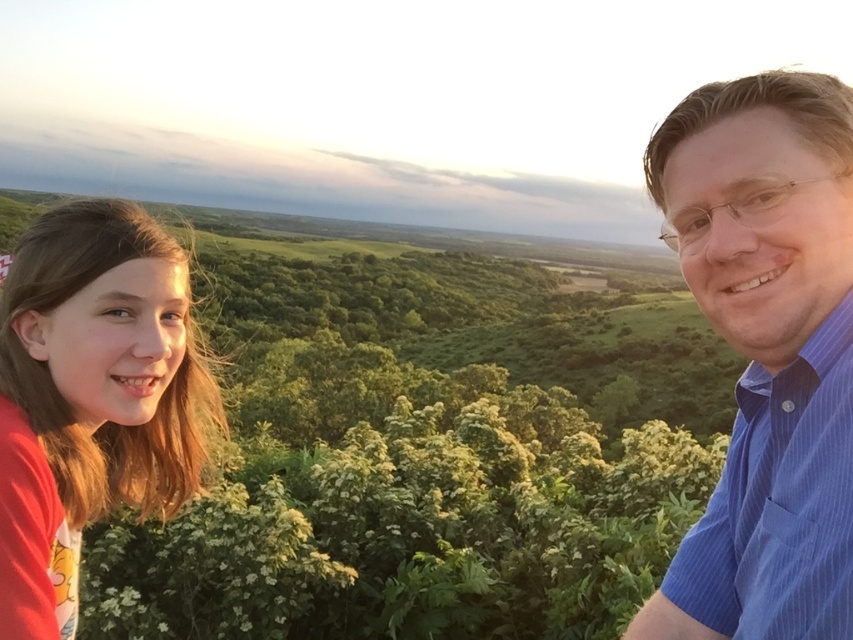
Question: In this image, where is blue striped shirt at upper right located relative to red cotton shirt at left?

Choices:
 (A) below
 (B) above

Answer: (A)

Question: Which of the following is the farthest from the observer?

Choices:
 (A) blue striped shirt at upper right
 (B) red cotton shirt at left

Answer: (B)

Question: Which point is closer to the camera taking this photo?

Choices:
 (A) (718, 250)
 (B) (160, 314)

Answer: (A)

Question: Observing the image, what is the correct spatial positioning of blue striped shirt at upper right in reference to red cotton shirt at left?

Choices:
 (A) right
 (B) left

Answer: (A)

Question: Can you confirm if blue striped shirt at upper right is positioned above red cotton shirt at left?

Choices:
 (A) no
 (B) yes

Answer: (A)

Question: Which of the following is the farthest from the observer?

Choices:
 (A) (773, 282)
 (B) (158, 419)

Answer: (B)